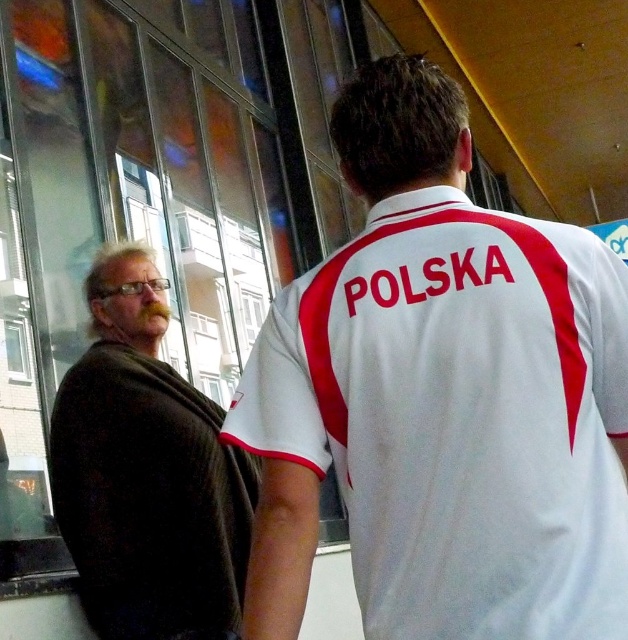
Question: Which object is closer to the camera taking this photo?

Choices:
 (A) white fabric shirt at center
 (B) dark brown sweater at left

Answer: (A)

Question: Which object appears closest to the camera in this image?

Choices:
 (A) white fabric shirt at center
 (B) dark brown sweater at left

Answer: (A)

Question: Which point is farther to the camera?

Choices:
 (A) (447, 525)
 (B) (141, 611)

Answer: (B)

Question: Is white fabric shirt at center above dark brown sweater at left?

Choices:
 (A) yes
 (B) no

Answer: (A)

Question: Where is white fabric shirt at center located in relation to dark brown sweater at left in the image?

Choices:
 (A) below
 (B) above

Answer: (B)

Question: Does white fabric shirt at center appear on the right side of dark brown sweater at left?

Choices:
 (A) no
 (B) yes

Answer: (B)